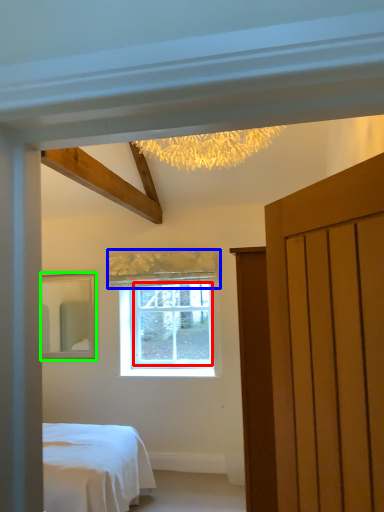
Question: Which is nearer to the window screen (highlighted by a red box)? curtain (highlighted by a blue box) or mirror (highlighted by a green box).

Choices:
 (A) curtain
 (B) mirror

Answer: (A)